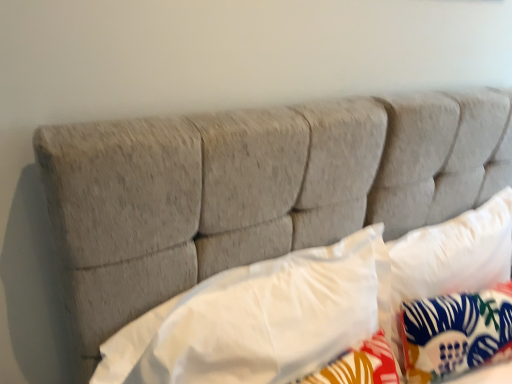
Question: Considering the relative positions of blue floral fabric pillow at center, which is counted as the 1th pillow, starting from the right, and white fabric pillow at center, which is the second pillow from left to right, in the image provided, is blue floral fabric pillow at center, which is counted as the 1th pillow, starting from the right, to the left or to the right of white fabric pillow at center, which is the second pillow from left to right,?

Choices:
 (A) left
 (B) right

Answer: (B)

Question: Relative to white fabric pillow at center, which is the second pillow from left to right, is blue floral fabric pillow at center, which ranks as the 3th pillow in left-to-right order, in front or behind?

Choices:
 (A) behind
 (B) front

Answer: (A)

Question: Estimate the real-world distances between objects in this image. Which object is closer to the white fabric pillow at center, which is the second pillow from left to right?

Choices:
 (A) blue floral fabric pillow at center, which ranks as the 3th pillow in left-to-right order
 (B) white soft pillow at center, which is counted as the 1th pillow, starting from the left

Answer: (A)

Question: Which is farther from the blue floral fabric pillow at center, which is counted as the 1th pillow, starting from the right?

Choices:
 (A) white soft pillow at center, which is the 3th pillow in right-to-left order
 (B) white fabric pillow at center, arranged as the second pillow when viewed from the right

Answer: (A)